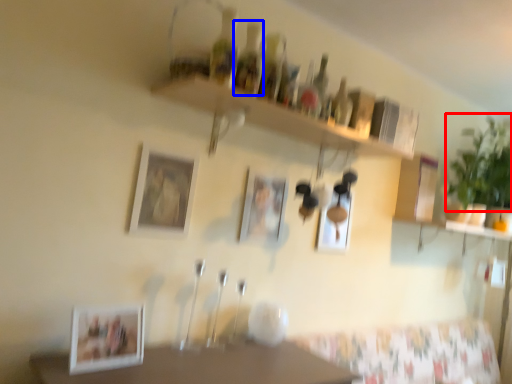
Question: Among these objects, which one is farthest to the camera, plant (highlighted by a red box) or bottle (highlighted by a blue box)?

Choices:
 (A) plant
 (B) bottle

Answer: (A)